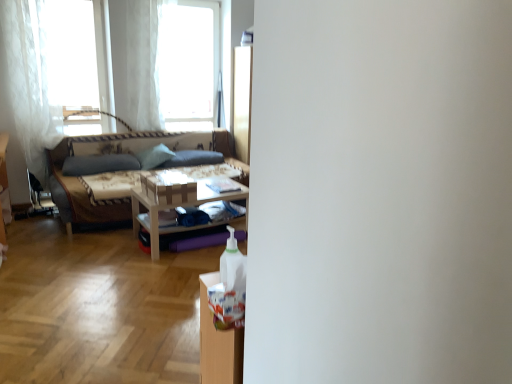
This screenshot has width=512, height=384. What are the coordinates of `white sheer curtain at upper left, which appears as the second curtain when viewed from the left` in the screenshot? It's located at (136, 62).

The image size is (512, 384). In order to click on transparent glass window at upper center, marked as the 1th window in a right-to-left arrangement in this screenshot , I will do `click(188, 63)`.

Where is `matte gray pillow at center, the 1th pillow positioned from the left`? matte gray pillow at center, the 1th pillow positioned from the left is located at coordinates (99, 164).

In order to click on dark gray fabric pillow at center, arranged as the third pillow when viewed from the left in this screenshot , I will do `click(193, 158)`.

In terms of height, does green fabric pillow at center, which ranks as the 2th pillow in left-to-right order, look taller or shorter compared to white sheer curtain at upper left, the first window when ordered from left to right?

Clearly, green fabric pillow at center, which ranks as the 2th pillow in left-to-right order, is shorter compared to white sheer curtain at upper left, the first window when ordered from left to right.

Can you confirm if green fabric pillow at center, which ranks as the 2th pillow in left-to-right order, is thinner than white sheer curtain at upper left, positioned as the 2th window in right-to-left order?

No, green fabric pillow at center, which ranks as the 2th pillow in left-to-right order, is not thinner than white sheer curtain at upper left, positioned as the 2th window in right-to-left order.

Is point (138, 157) farther from viewer compared to point (57, 104)?

Yes.

Is white sheer curtain at upper left, the first window when ordered from left to right, surrounded by green fabric pillow at center, which ranks as the 2th pillow in left-to-right order?

That's incorrect, white sheer curtain at upper left, the first window when ordered from left to right, is not inside green fabric pillow at center, which ranks as the 2th pillow in left-to-right order.

Is matte gray pillow at center, the 1th pillow positioned from the left, shorter than dark gray fabric pillow at center, which is the 1th pillow from right to left?

Yes, matte gray pillow at center, the 1th pillow positioned from the left, is shorter than dark gray fabric pillow at center, which is the 1th pillow from right to left.

Is point (110, 157) behind point (220, 163)?

No.

From the image's perspective, would you say matte gray pillow at center, the 1th pillow positioned from the left, is positioned over dark gray fabric pillow at center, which is the 1th pillow from right to left?

Incorrect, from the image's perspective, matte gray pillow at center, the 1th pillow positioned from the left, is lower than dark gray fabric pillow at center, which is the 1th pillow from right to left.

Does matte gray pillow at center, the 1th pillow positioned from the left, turn towards dark gray fabric pillow at center, which is the 1th pillow from right to left?

No, matte gray pillow at center, the 1th pillow positioned from the left, is not aimed at dark gray fabric pillow at center, which is the 1th pillow from right to left.

Is white sheer curtain at upper left, the first window when ordered from left to right, closer to the viewer compared to transparent glass window at upper center, marked as the 1th window in a right-to-left arrangement?

Yes, white sheer curtain at upper left, the first window when ordered from left to right, is closer to the viewer.

Considering the relative positions of white sheer curtain at upper left, positioned as the 2th window in right-to-left order, and transparent glass window at upper center, marked as the 1th window in a right-to-left arrangement, in the image provided, is white sheer curtain at upper left, positioned as the 2th window in right-to-left order, to the right of transparent glass window at upper center, marked as the 1th window in a right-to-left arrangement, from the viewer's perspective?

No.

In the scene shown: Is dark gray fabric pillow at center, which is the 1th pillow from right to left, wider than white sheer curtain at upper left, positioned as the 2th window in right-to-left order?

Yes.

Does point (223, 160) appear closer or farther from the camera than point (65, 112)?

Point (223, 160) is farther from the camera than point (65, 112).

Could you tell me if dark gray fabric pillow at center, arranged as the third pillow when viewed from the left, is turned towards white sheer curtain at upper left, the first window when ordered from left to right?

No.

How many degrees apart are the facing directions of transparent glass window at upper center, marked as the 1th window in a right-to-left arrangement, and dark gray fabric pillow at center, arranged as the third pillow when viewed from the left?

The facing directions of transparent glass window at upper center, marked as the 1th window in a right-to-left arrangement, and dark gray fabric pillow at center, arranged as the third pillow when viewed from the left, are 0.332 degrees apart.

Is there a large distance between transparent glass window at upper center, marked as the 1th window in a right-to-left arrangement, and dark gray fabric pillow at center, arranged as the third pillow when viewed from the left?

transparent glass window at upper center, marked as the 1th window in a right-to-left arrangement, is near dark gray fabric pillow at center, arranged as the third pillow when viewed from the left, not far away.

Which is in front, point (167, 34) or point (195, 157)?

The point (167, 34) is in front.

From the image's perspective, between transparent glass window at upper center, arranged as the second window when viewed from the left, and dark gray fabric pillow at center, arranged as the third pillow when viewed from the left, who is located below?

dark gray fabric pillow at center, arranged as the third pillow when viewed from the left, appears lower in the image.

Considering the relative positions of wooden table at center and green fabric pillow at center, the 2th pillow from the right, in the image provided, is wooden table at center to the left of green fabric pillow at center, the 2th pillow from the right, from the viewer's perspective?

No.

From a real-world perspective, which object stands above the other?

green fabric pillow at center, the 2th pillow from the right.

Could you tell me if wooden table at center is facing green fabric pillow at center, which ranks as the 2th pillow in left-to-right order?

No, wooden table at center does not turn towards green fabric pillow at center, which ranks as the 2th pillow in left-to-right order.

Could you tell me if transparent glass window at upper center, marked as the 1th window in a right-to-left arrangement, is turned towards white sheer curtain at upper left, the 1th curtain positioned from the right?

No, transparent glass window at upper center, marked as the 1th window in a right-to-left arrangement, does not turn towards white sheer curtain at upper left, the 1th curtain positioned from the right.

In the image, is transparent glass window at upper center, arranged as the second window when viewed from the left, on the left side or the right side of white sheer curtain at upper left, the 1th curtain positioned from the right?

transparent glass window at upper center, arranged as the second window when viewed from the left, is positioned on white sheer curtain at upper left, the 1th curtain positioned from the right,'s right side.

Which of these two, transparent glass window at upper center, arranged as the second window when viewed from the left, or white sheer curtain at upper left, the 1th curtain positioned from the right, is smaller?

Smaller between the two is white sheer curtain at upper left, the 1th curtain positioned from the right.

Identify the location of window located in front of the green fabric pillow at center, which ranks as the 2th pillow in left-to-right order. The image size is (512, 384). (76, 62).

From the image's perspective, count 2nd pillows upward from the matte gray pillow at center, the 1th pillow positioned from the left, and point to it. Please provide its 2D coordinates.

[(193, 158)]

Based on their spatial positions, is white sheer curtain at upper left, which appears as the second curtain when viewed from the left, or white sheer curtain at left, the second curtain viewed from the right, further from transparent glass window at upper center, arranged as the second window when viewed from the left?

Based on the image, white sheer curtain at left, the second curtain viewed from the right, appears to be further to transparent glass window at upper center, arranged as the second window when viewed from the left.

Which object lies further to the anchor point white sheer curtain at upper left, the first window when ordered from left to right, wooden table at center or dark gray fabric pillow at center, which is the 1th pillow from right to left?

wooden table at center lies further to white sheer curtain at upper left, the first window when ordered from left to right, than the other object.

When comparing their distances from textured beige fabric couch at left, does transparent glass window at upper center, arranged as the second window when viewed from the left, or green fabric pillow at center, which ranks as the 2th pillow in left-to-right order, seem closer?

Based on the image, green fabric pillow at center, which ranks as the 2th pillow in left-to-right order, appears to be nearer to textured beige fabric couch at left.

Based on their spatial positions, is dark gray fabric pillow at center, arranged as the third pillow when viewed from the left, or green fabric pillow at center, which ranks as the 2th pillow in left-to-right order, closer to white sheer curtain at upper left, positioned as the 2th window in right-to-left order?

green fabric pillow at center, which ranks as the 2th pillow in left-to-right order, is closer to white sheer curtain at upper left, positioned as the 2th window in right-to-left order.

Estimate the real-world distances between objects in this image. Which object is further from dark gray fabric pillow at center, which is the 1th pillow from right to left, white sheer curtain at left, the second curtain viewed from the right, or green fabric pillow at center, the 2th pillow from the right?

The object further to dark gray fabric pillow at center, which is the 1th pillow from right to left, is white sheer curtain at left, the second curtain viewed from the right.

When comparing their distances from white sheer curtain at left, the 1th curtain positioned from the left, does white sheer curtain at upper left, positioned as the 2th window in right-to-left order, or wooden table at center seem further?

wooden table at center is further to white sheer curtain at left, the 1th curtain positioned from the left.

Which object lies further to the anchor point wooden table at center, white sheer curtain at left, the 1th curtain positioned from the left, or white sheer curtain at upper left, which appears as the second curtain when viewed from the left?

white sheer curtain at left, the 1th curtain positioned from the left, is positioned further to the anchor wooden table at center.

Based on their spatial positions, is green fabric pillow at center, the 2th pillow from the right, or white sheer curtain at upper left, the first window when ordered from left to right, closer to dark gray fabric pillow at center, arranged as the third pillow when viewed from the left?

green fabric pillow at center, the 2th pillow from the right, lies closer to dark gray fabric pillow at center, arranged as the third pillow when viewed from the left, than the other object.

Locate an element on the screen. The image size is (512, 384). studio couch between white sheer curtain at upper left, positioned as the 2th window in right-to-left order, and dark gray fabric pillow at center, which is the 1th pillow from right to left, from left to right is located at coordinates (114, 155).

Identify the location of studio couch between matte gray pillow at center, the 1th pillow positioned from the left, and wooden table at center from left to right. (114, 155).

You are a GUI agent. You are given a task and a screenshot of the screen. Output one action in this format:
    pyautogui.click(x=<x>, y=<y>)
    Task: Click on the window situated between white sheer curtain at left, the 1th curtain positioned from the left, and green fabric pillow at center, the 2th pillow from the right, from left to right
    The image size is (512, 384).
    Given the screenshot: What is the action you would take?
    pyautogui.click(x=76, y=62)

Find the location of a particular element. This screenshot has height=384, width=512. studio couch between white sheer curtain at left, the second curtain viewed from the right, and dark gray fabric pillow at center, which is the 1th pillow from right to left, in the horizontal direction is located at coordinates (114, 155).